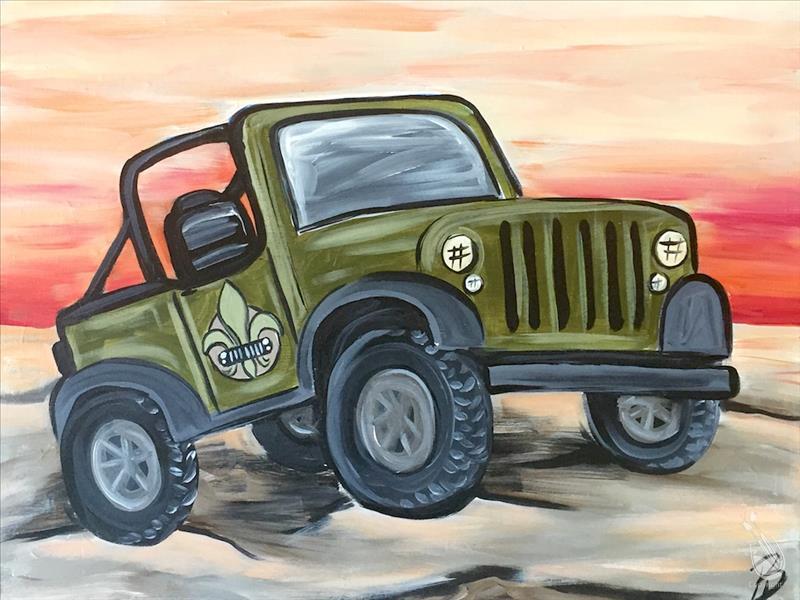
Find the location of `frame around window`. frame around window is located at coordinates (269, 187), (309, 107), (490, 151).